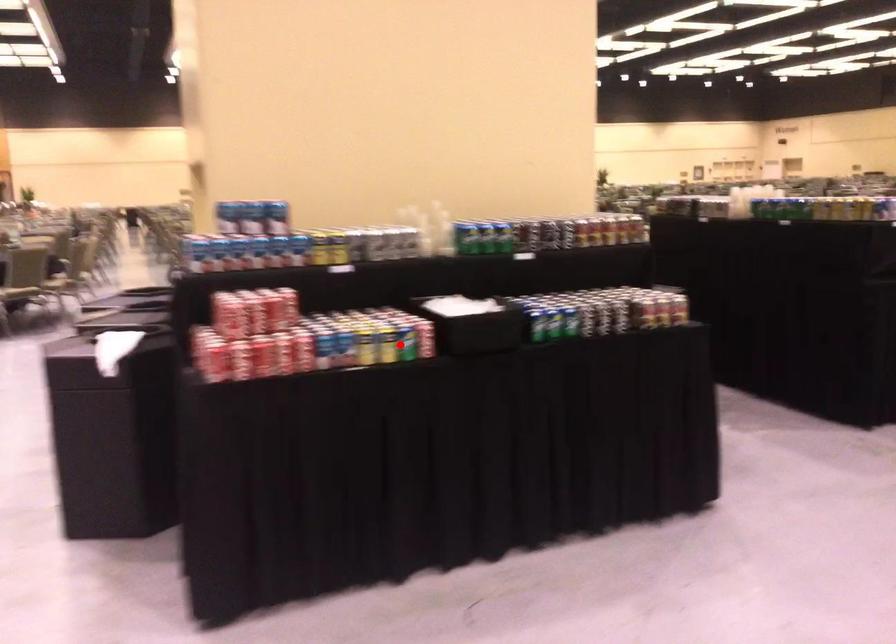
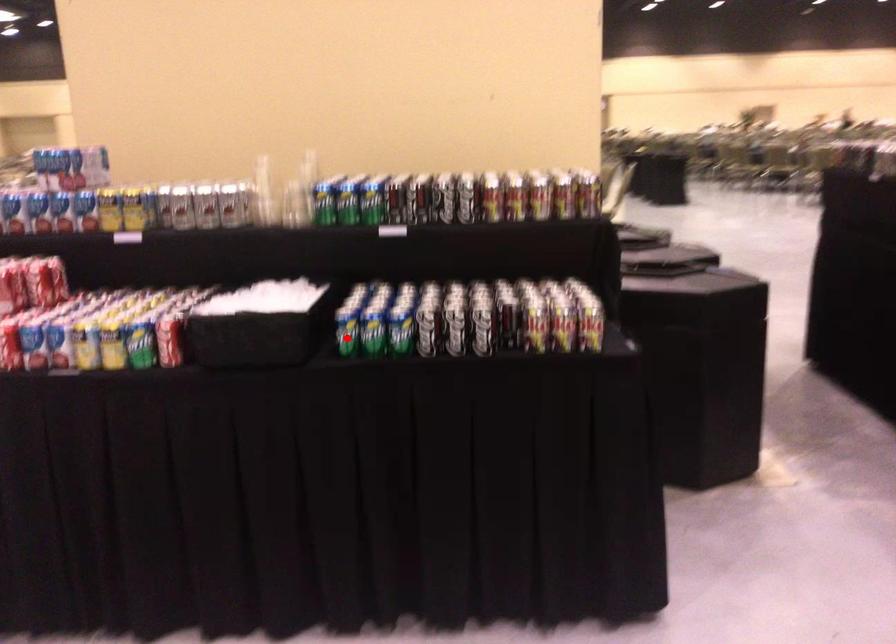
I am providing you with two images of the same scene from different viewpoints. A red point is marked on the first image and another point is marked on the second image. Is the red point in image1 aligned with the point shown in image2?

No